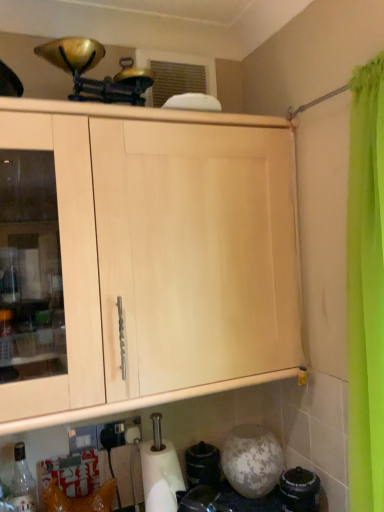
Question: Should I look upward or downward to see translucent glass bottle at lower left?

Choices:
 (A) down
 (B) up

Answer: (A)

Question: Can you confirm if white matte paper towel at lower center is positioned to the right of translucent glass bottle at lower left?

Choices:
 (A) yes
 (B) no

Answer: (A)

Question: Is white matte paper towel at lower center at the left side of translucent glass bottle at lower left?

Choices:
 (A) yes
 (B) no

Answer: (B)

Question: From the image's perspective, is white matte paper towel at lower center beneath translucent glass bottle at lower left?

Choices:
 (A) no
 (B) yes

Answer: (A)

Question: Is white matte paper towel at lower center next to translucent glass bottle at lower left and touching it?

Choices:
 (A) no
 (B) yes

Answer: (A)

Question: Is white matte paper towel at lower center smaller than translucent glass bottle at lower left?

Choices:
 (A) yes
 (B) no

Answer: (B)

Question: Is white matte paper towel at lower center closer to camera compared to translucent glass bottle at lower left?

Choices:
 (A) no
 (B) yes

Answer: (A)

Question: From the image's perspective, is translucent glass bottle at lower left over white matte paper towel at lower center?

Choices:
 (A) no
 (B) yes

Answer: (A)

Question: Does translucent glass bottle at lower left have a greater height compared to white matte paper towel at lower center?

Choices:
 (A) yes
 (B) no

Answer: (B)

Question: Is translucent glass bottle at lower left further to camera compared to white matte paper towel at lower center?

Choices:
 (A) yes
 (B) no

Answer: (B)

Question: Considering the relative sizes of translucent glass bottle at lower left and white matte paper towel at lower center in the image provided, is translucent glass bottle at lower left shorter than white matte paper towel at lower center?

Choices:
 (A) no
 (B) yes

Answer: (B)

Question: Can you confirm if translucent glass bottle at lower left is bigger than white matte paper towel at lower center?

Choices:
 (A) no
 (B) yes

Answer: (A)

Question: Is translucent glass bottle at lower left smaller than white matte paper towel at lower center?

Choices:
 (A) yes
 (B) no

Answer: (A)

Question: Considering the positions of white matte paper towel at lower center and translucent glass bottle at lower left in the image, is white matte paper towel at lower center wider or thinner than translucent glass bottle at lower left?

Choices:
 (A) thin
 (B) wide

Answer: (B)